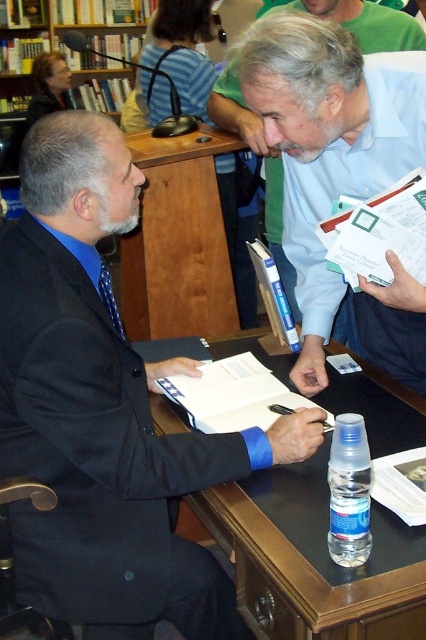
Question: Which point appears farthest from the camera in this image?

Choices:
 (A) (317, 486)
 (B) (301, 248)

Answer: (B)

Question: Does black matte suit at center have a smaller size compared to brown wood table at center?

Choices:
 (A) yes
 (B) no

Answer: (B)

Question: Can you confirm if white paper at upper center is positioned to the left of black wood table at center?

Choices:
 (A) yes
 (B) no

Answer: (B)

Question: Estimate the real-world distances between objects in this image. Which object is farther from the black wood table at center?

Choices:
 (A) brown wood table at center
 (B) black matte suit at center

Answer: (A)

Question: Which object is closer to the camera taking this photo?

Choices:
 (A) white paper at upper center
 (B) white paper at center
 (C) black matte suit at center

Answer: (C)

Question: Is black matte suit at center below white paper at upper center?

Choices:
 (A) yes
 (B) no

Answer: (A)